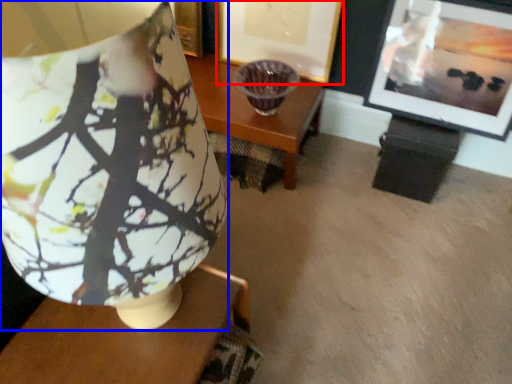
Question: Which object is further to the camera taking this photo, picture frame (highlighted by a red box) or lamp (highlighted by a blue box)?

Choices:
 (A) picture frame
 (B) lamp

Answer: (A)